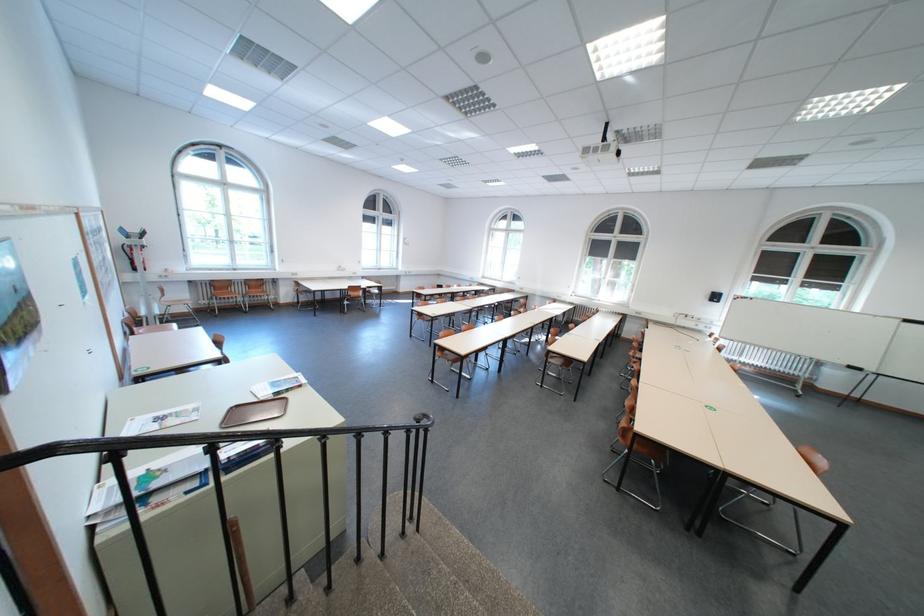
Identify the location of black stair railing. (189, 440).